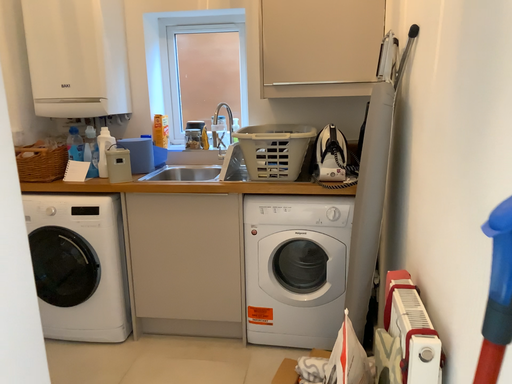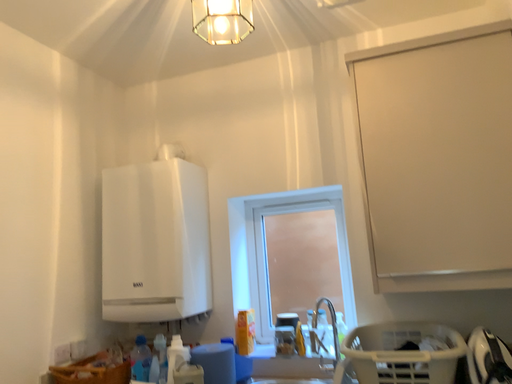
Question: How did the camera likely rotate when shooting the video?

Choices:
 (A) rotated downward
 (B) rotated upward

Answer: (B)